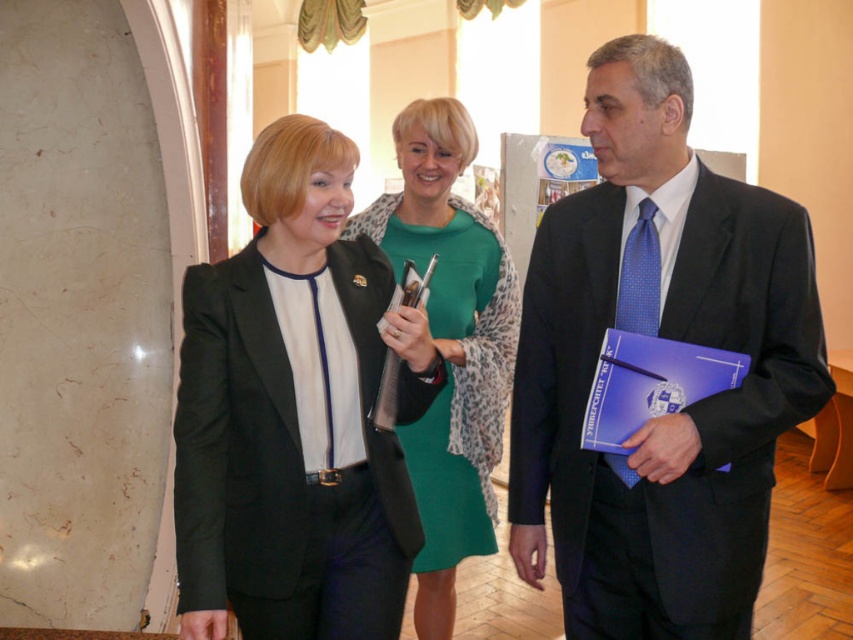
Question: Is matte black suit at center to the right of green matte dress at center from the viewer's perspective?

Choices:
 (A) yes
 (B) no

Answer: (A)

Question: Is matte black suit at center bigger than matte black blazer at center?

Choices:
 (A) no
 (B) yes

Answer: (B)

Question: Which point appears farthest from the camera in this image?

Choices:
 (A) (428, 234)
 (B) (289, 125)
 (C) (746, 616)

Answer: (A)

Question: Estimate the real-world distances between objects in this image. Which object is closer to the matte black blazer at center?

Choices:
 (A) matte black suit at center
 (B) green matte dress at center

Answer: (B)

Question: Is matte black blazer at center wider than green matte dress at center?

Choices:
 (A) no
 (B) yes

Answer: (A)

Question: Among these objects, which one is nearest to the camera?

Choices:
 (A) matte black blazer at center
 (B) green matte dress at center

Answer: (A)